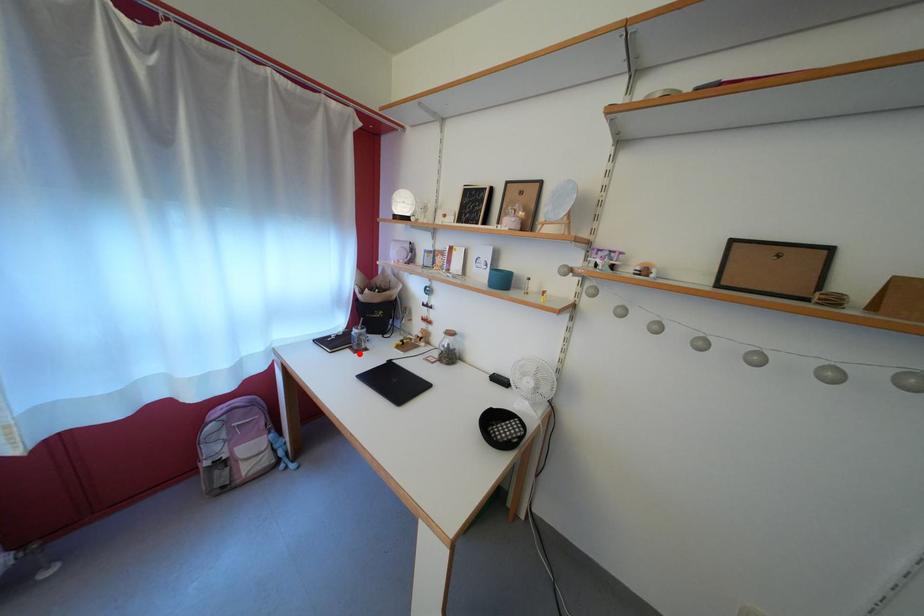
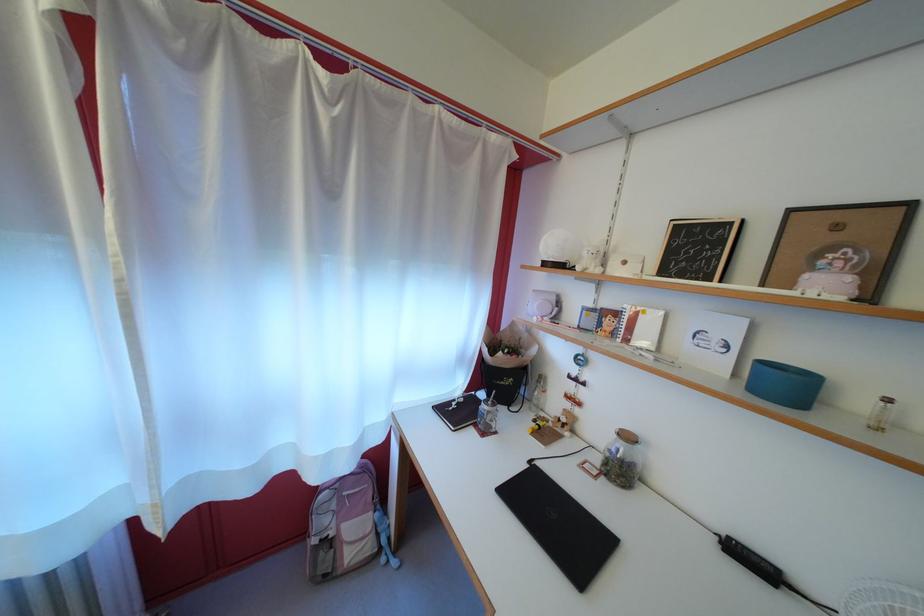
The point at the highlighted location is marked in the first image. Where is the corresponding point in the second image?

(483, 431)